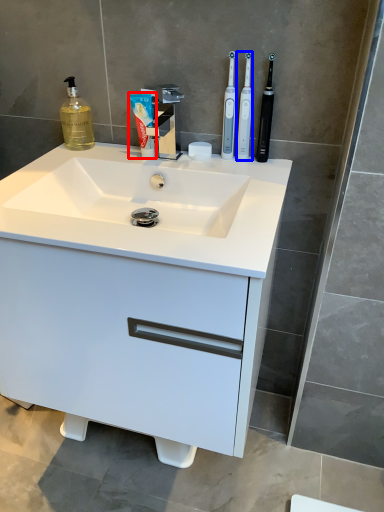
Question: Which of the following is the closest to the observer, toothpaste (highlighted by a red box) or toothbrush (highlighted by a blue box)?

Choices:
 (A) toothpaste
 (B) toothbrush

Answer: (B)